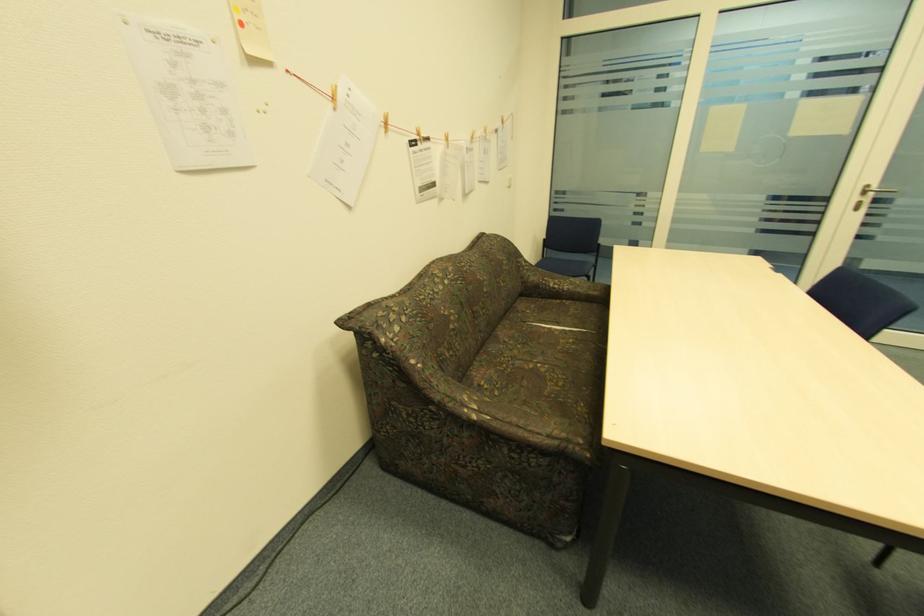
What do you see at coordinates (566, 265) in the screenshot?
I see `the blue chair sitting surface` at bounding box center [566, 265].